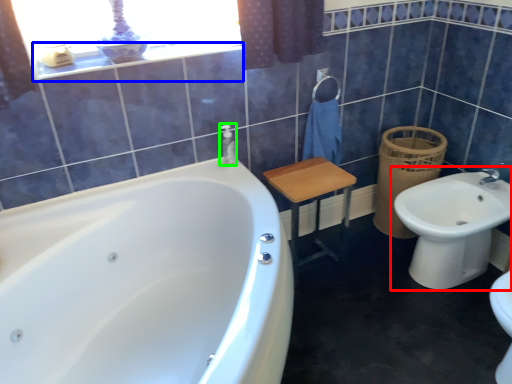
Question: Considering the real-world distances, which object is closest to sink (highlighted by a red box)? balustrade (highlighted by a blue box) or toiletry (highlighted by a green box).

Choices:
 (A) balustrade
 (B) toiletry

Answer: (B)